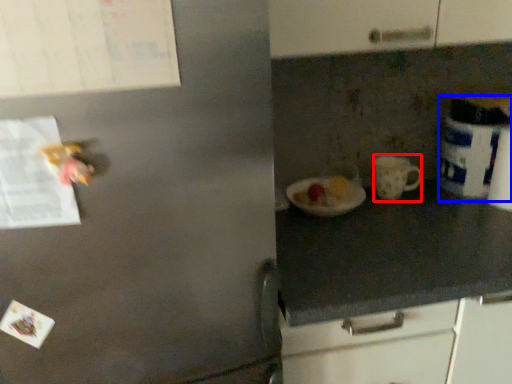
Question: Which point is closer to the camera, mug (highlighted by a red box) or appliance (highlighted by a blue box)?

Choices:
 (A) mug
 (B) appliance

Answer: (B)